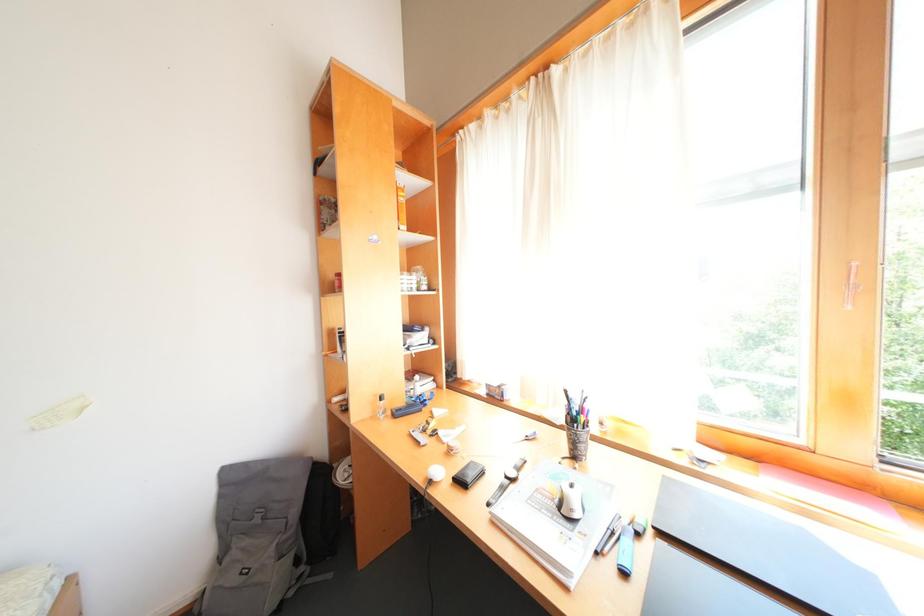
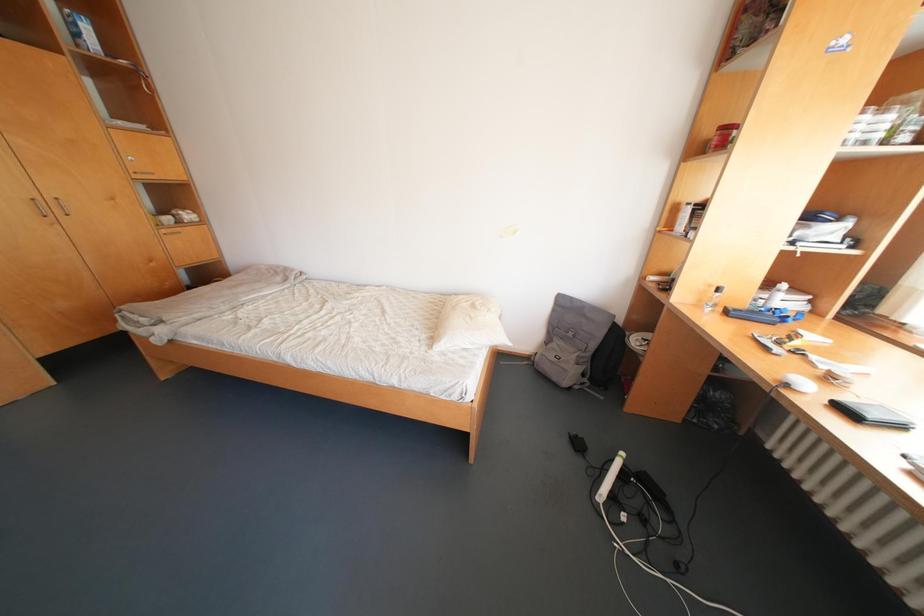
From the picture: Based on the continuous images, in which direction is the camera rotating?

The camera rotated toward left-down.